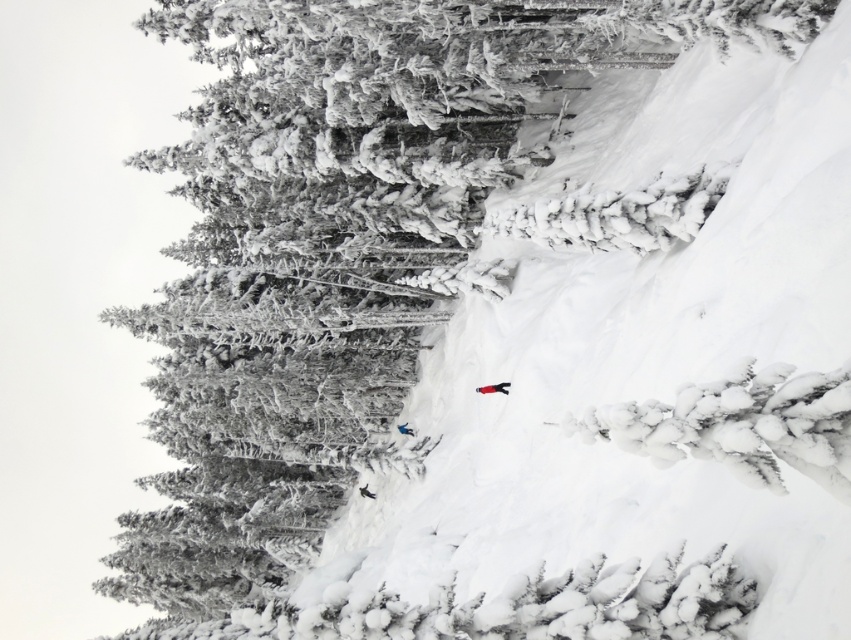
You are a photographer trying to capture the white matte snowboard at center and the white matte snowboarder at center in a single shot. Which object should you focus on first to ensure both are in frame?

The white matte snowboard at center is in front of the white matte snowboarder at center, so you should focus on the white matte snowboard at center first to ensure both are in frame.

You are a photographer planning to capture a closeup shot of the white matte snowboard at center and the white matte snowboarder at center. Since both are white, which one will appear bigger in the photo?

The white matte snowboard at center will appear bigger in the photo because it has a larger size compared to the white matte snowboarder at center.

You are a photographer planning to take a photo of the two points marked in the snowy forest scene. The points are located at coordinates point(504, 390) and point(403, 432). To ensure both points are in focus, you need to know which one is closer to the camera. Which point is nearer to the camera?

Point(504, 390) is closer to the viewer than point(403, 432), so it is nearer to the camera.